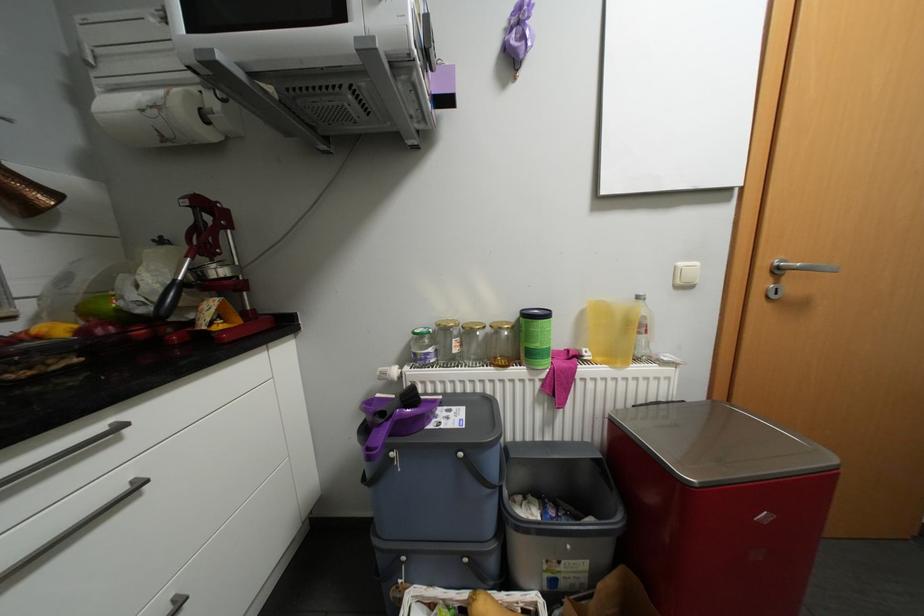
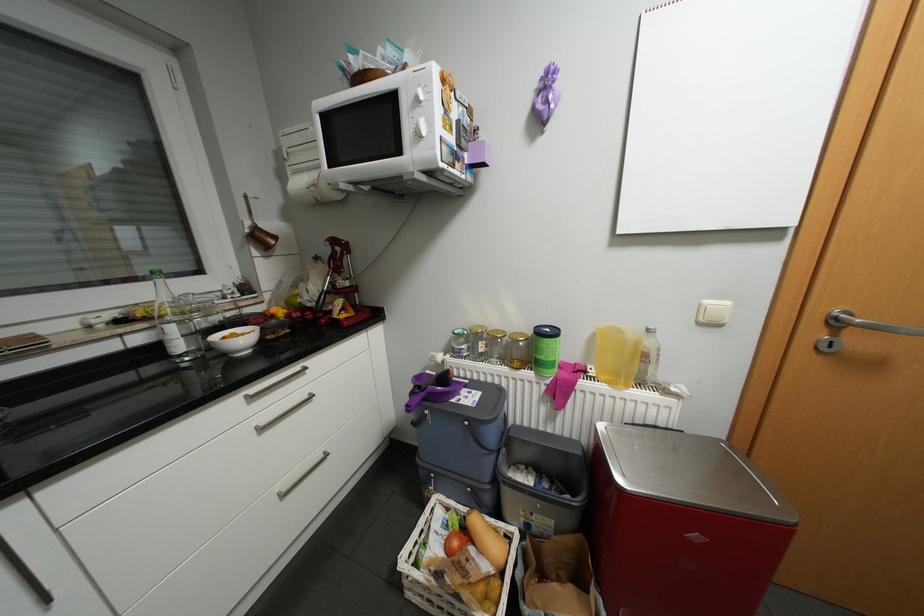
In the second image, find the point that corresponds to [537,367] in the first image.

(544, 373)